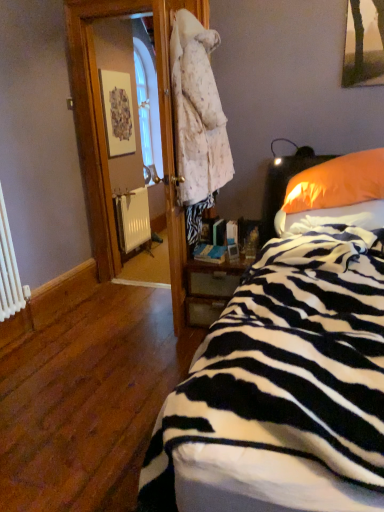
Image resolution: width=384 pixels, height=512 pixels. What do you see at coordinates (117, 112) in the screenshot?
I see `wooden picture frame at upper left` at bounding box center [117, 112].

At what (x,y) coordinates should I click in order to perform the action: click on zebra-patterned fabric at right. Please return your answer as a coordinate pair (x, y). This screenshot has height=512, width=384. Looking at the image, I should click on (331, 218).

Locate an element on the screen. The width and height of the screenshot is (384, 512). orange fabric pillow at right is located at coordinates point(335,194).

What do you see at coordinates (335, 194) in the screenshot?
I see `orange fabric pillow at right` at bounding box center [335, 194].

Where is `wooden nightstand at center`? This screenshot has height=512, width=384. wooden nightstand at center is located at coordinates (211, 288).

From the image's perspective, does orange fabric pillow at right appear higher than zebra-patterned fabric at lower right?

Yes, from the image's perspective, orange fabric pillow at right is over zebra-patterned fabric at lower right.

This screenshot has width=384, height=512. Identify the location of bed that appears below the orange fabric pillow at right (from the image's perspective). point(283,388).

From a real-world perspective, is orange fabric pillow at right located beneath zebra-patterned fabric at lower right?

No, from a real-world perspective, orange fabric pillow at right is not beneath zebra-patterned fabric at lower right.

Based on the photo, is orange fabric pillow at right oriented away from zebra-patterned fabric at lower right?

Yes, orange fabric pillow at right's orientation is away from zebra-patterned fabric at lower right.

Looking at the image, does white matte radiator at lower left seem bigger or smaller compared to zebra-patterned fabric at lower right?

In the image, white matte radiator at lower left appears to be smaller than zebra-patterned fabric at lower right.

Which object is wider, white matte radiator at lower left or zebra-patterned fabric at lower right?

With larger width is zebra-patterned fabric at lower right.

Considering the relative positions of white matte radiator at lower left and zebra-patterned fabric at lower right in the image provided, is white matte radiator at lower left to the left or to the right of zebra-patterned fabric at lower right?

Clearly, white matte radiator at lower left is on the left of zebra-patterned fabric at lower right in the image.

Is white matte radiator at lower left oriented away from zebra-patterned fabric at lower right?

That's not correct — white matte radiator at lower left is not looking away from zebra-patterned fabric at lower right.

Is orange fabric pillow at right located outside wooden picture frame at upper left?

That's correct, orange fabric pillow at right is outside of wooden picture frame at upper left.

Which is more to the right, orange fabric pillow at right or wooden picture frame at upper left?

From the viewer's perspective, orange fabric pillow at right appears more on the right side.

Is orange fabric pillow at right oriented towards wooden picture frame at upper left?

No, orange fabric pillow at right does not turn towards wooden picture frame at upper left.

Considering the relative sizes of orange fabric pillow at right and wooden picture frame at upper left in the image provided, is orange fabric pillow at right smaller than wooden picture frame at upper left?

No, orange fabric pillow at right is not smaller than wooden picture frame at upper left.

Which of these two, zebra-patterned fabric at lower right or zebra-patterned fabric at right, stands taller?

zebra-patterned fabric at lower right.

In the scene shown: From the image's perspective, which object appears higher, zebra-patterned fabric at lower right or zebra-patterned fabric at right?

zebra-patterned fabric at right.

Locate an element on the screen. sheet that is on the right side of zebra-patterned fabric at lower right is located at coordinates (331, 218).

Is zebra-patterned fabric at lower right far from zebra-patterned fabric at right?

zebra-patterned fabric at lower right is near zebra-patterned fabric at right, not far away.

Between white matte radiator at lower left and wooden nightstand at center, which one appears on the left side from the viewer's perspective?

white matte radiator at lower left is more to the left.

Between white matte radiator at lower left and wooden nightstand at center, which one has less height?

wooden nightstand at center is shorter.

Considering the sizes of objects white matte radiator at lower left and wooden nightstand at center in the image provided, who is wider, white matte radiator at lower left or wooden nightstand at center?

wooden nightstand at center.

Looking at this image, looking at the image, does white matte radiator at lower left seem bigger or smaller compared to wooden nightstand at center?

In the image, white matte radiator at lower left appears to be smaller than wooden nightstand at center.

Who is smaller, wooden nightstand at center or zebra-patterned fabric at lower right?

Smaller between the two is wooden nightstand at center.

You are a GUI agent. You are given a task and a screenshot of the screen. Output one action in this format:
    pyautogui.click(x=<x>, y=<y>)
    Task: Click on the bed in front of the wooden nightstand at center
    
    Given the screenshot: What is the action you would take?
    click(283, 388)

Between point (231, 283) and point (337, 256), which one is positioned in front?

The point (337, 256) is closer to the camera.

Would you consider wooden nightstand at center to be distant from zebra-patterned fabric at lower right?

wooden nightstand at center is actually quite close to zebra-patterned fabric at lower right.

Is wooden picture frame at upper left aimed at wooden nightstand at center?

No, wooden picture frame at upper left is not aimed at wooden nightstand at center.

What's the angular difference between wooden picture frame at upper left and wooden nightstand at center's facing directions?

90 degrees.

Does wooden picture frame at upper left have a larger size compared to wooden nightstand at center?

No, wooden picture frame at upper left is not bigger than wooden nightstand at center.

Who is shorter, wooden picture frame at upper left or wooden nightstand at center?

Standing shorter between the two is wooden nightstand at center.

You are a GUI agent. You are given a task and a screenshot of the screen. Output one action in this format:
    pyautogui.click(x=<x>, y=<y>)
    Task: Click on the bed below the orange fabric pillow at right (from the image's perspective)
    The height and width of the screenshot is (512, 384).
    Given the screenshot: What is the action you would take?
    pyautogui.click(x=283, y=388)

This screenshot has width=384, height=512. In order to click on bed lying on the right of white matte radiator at lower left in this screenshot , I will do `click(283, 388)`.

Consider the image. From the image, which object appears to be nearer to wooden picture frame at upper left, zebra-patterned fabric at right or white matte radiator at lower left?

white matte radiator at lower left is positioned closer to the anchor wooden picture frame at upper left.

Based on their spatial positions, is orange fabric pillow at right or zebra-patterned fabric at lower right closer to zebra-patterned fabric at right?

orange fabric pillow at right is positioned closer to the anchor zebra-patterned fabric at right.

Considering their positions, is wooden picture frame at upper left positioned closer to zebra-patterned fabric at right than zebra-patterned fabric at lower right?

zebra-patterned fabric at lower right lies closer to zebra-patterned fabric at right than the other object.

Which object lies further to the anchor point white matte radiator at lower left, zebra-patterned fabric at lower right or wooden picture frame at upper left?

zebra-patterned fabric at lower right lies further to white matte radiator at lower left than the other object.

Based on their spatial positions, is wooden picture frame at upper left or white matte radiator at lower left further from wooden nightstand at center?

wooden picture frame at upper left lies further to wooden nightstand at center than the other object.

From the image, which object appears to be farther from white matte radiator at lower left, wooden nightstand at center or wooden picture frame at upper left?

Based on the image, wooden nightstand at center appears to be further to white matte radiator at lower left.

Looking at the image, which one is located further to orange fabric pillow at right, white matte radiator at lower left or zebra-patterned fabric at lower right?

Among the two, white matte radiator at lower left is located further to orange fabric pillow at right.

When comparing their distances from wooden picture frame at upper left, does white matte radiator at lower left or orange fabric pillow at right seem further?

orange fabric pillow at right is further to wooden picture frame at upper left.

Where is `pillow positioned between zebra-patterned fabric at lower right and wooden picture frame at upper left from near to far`? This screenshot has width=384, height=512. pillow positioned between zebra-patterned fabric at lower right and wooden picture frame at upper left from near to far is located at coordinates (335, 194).

Identify the location of nightstand positioned between orange fabric pillow at right and white matte radiator at lower left from near to far. (211, 288).

You are a GUI agent. You are given a task and a screenshot of the screen. Output one action in this format:
    pyautogui.click(x=<x>, y=<y>)
    Task: Click on the sheet between zebra-patterned fabric at lower right and wooden nightstand at center in the front-back direction
    This screenshot has height=512, width=384.
    Given the screenshot: What is the action you would take?
    pyautogui.click(x=331, y=218)

At what (x,y) coordinates should I click in order to perform the action: click on sheet located between wooden picture frame at upper left and orange fabric pillow at right in the left-right direction. Please return your answer as a coordinate pair (x, y). This screenshot has width=384, height=512. Looking at the image, I should click on (331, 218).